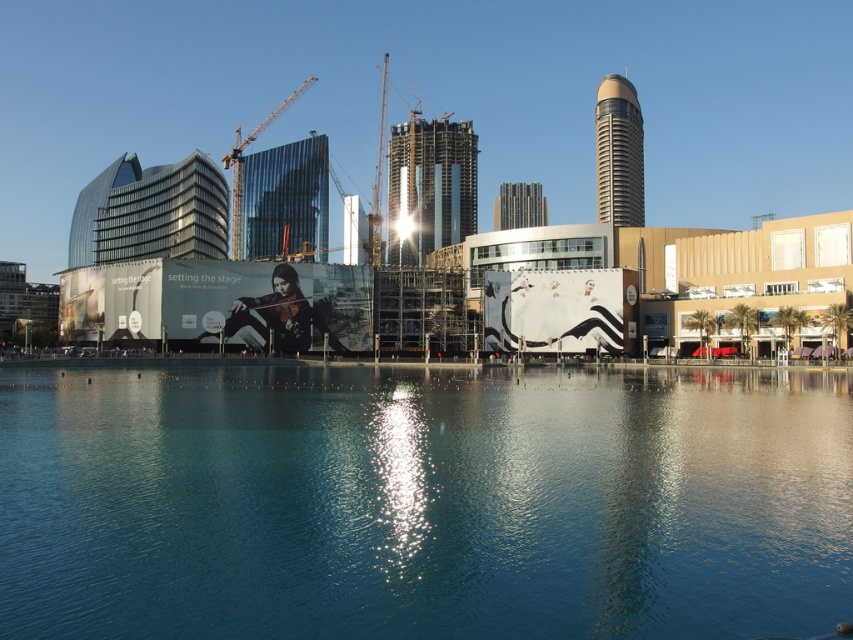
Question: Observing the image, what is the correct spatial positioning of clear blue water at center in reference to metallic construction crane at center?

Choices:
 (A) left
 (B) right

Answer: (B)

Question: Considering the relative positions of clear blue water at center and metallic construction crane at center in the image provided, where is clear blue water at center located with respect to metallic construction crane at center?

Choices:
 (A) above
 (B) below

Answer: (B)

Question: Is clear blue water at center positioned at the back of metallic construction crane at center?

Choices:
 (A) no
 (B) yes

Answer: (A)

Question: Among these objects, which one is nearest to the camera?

Choices:
 (A) clear blue water at center
 (B) metallic construction crane at center

Answer: (A)

Question: Which object appears closest to the camera in this image?

Choices:
 (A) metallic construction crane at center
 (B) clear blue water at center

Answer: (B)